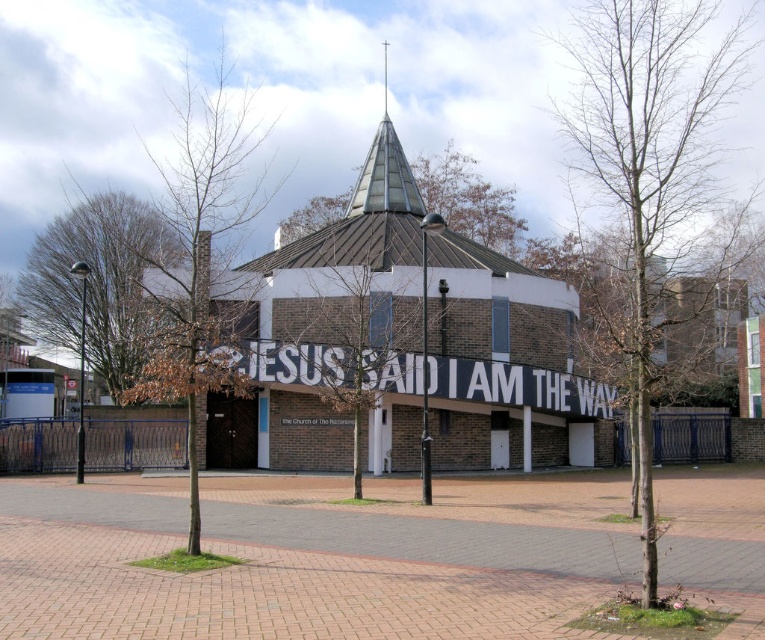
You are an architect evaluating the church building. You need to determine if the shiny metallic spire at center top can be replaced with a larger decorative cross without exceeding the current size of the brick textured church at center. Can this be done?

The brick textured church at center is larger in size than the shiny metallic spire at center top. Since the spire is smaller, replacing it with a larger decorative cross might exceed the church building size, so it depends on the cross dimensions. However, the description only states the church is larger than the spire, but doesn not provide exact measurements. Without specific size data, it is uncertain if the cross would fit within the church dimensions.

Consider the image. You are standing in front of the church and want to take a photo of the entire building. Which object, the brick textured church at center or the shiny metallic spire at center top, should you focus on to ensure both are fully visible in the frame?

The brick textured church at center is taller than the shiny metallic spire at center top, so focusing on the church will ensure both are fully visible in the frame.

You are standing in front of the modern church building. Where is the brick textured church at center located in terms of its 2D coordinates?

The brick textured church at center is located at the 2D coordinates of point (x=399, y=344).